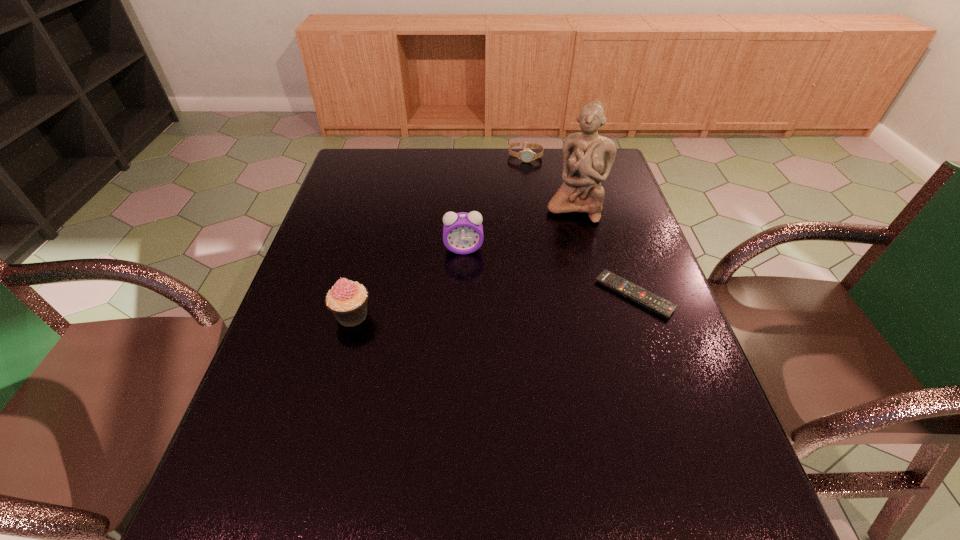
Where is `object located in the left edge section of the desktop`? object located in the left edge section of the desktop is located at coordinates (347, 300).

Find the location of a particular element. This screenshot has width=960, height=540. remote control positioned at the right edge is located at coordinates (662, 307).

Where is `figurine at the right edge`? figurine at the right edge is located at coordinates (587, 157).

The height and width of the screenshot is (540, 960). What are the coordinates of `vacant space at the far edge of the desktop` in the screenshot? It's located at click(x=480, y=184).

In the image, there is a desktop. Identify the location of vacant space at the near edge. (411, 441).

Image resolution: width=960 pixels, height=540 pixels. Identify the location of vacant space at the left edge. (324, 291).

Locate an element on the screen. Image resolution: width=960 pixels, height=540 pixels. free location at the right edge is located at coordinates (605, 268).

Where is `free region at the far left corner of the desktop`? The image size is (960, 540). free region at the far left corner of the desktop is located at coordinates (371, 154).

The width and height of the screenshot is (960, 540). I want to click on vacant region at the near left corner of the desktop, so click(x=306, y=428).

Locate an element on the screen. empty space between the figurine and the second shortest object is located at coordinates (550, 182).